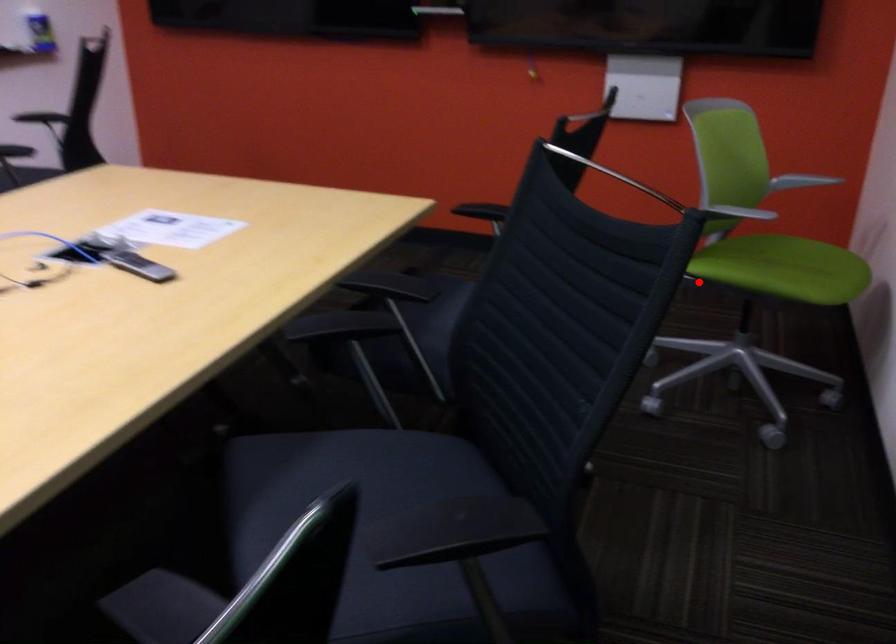
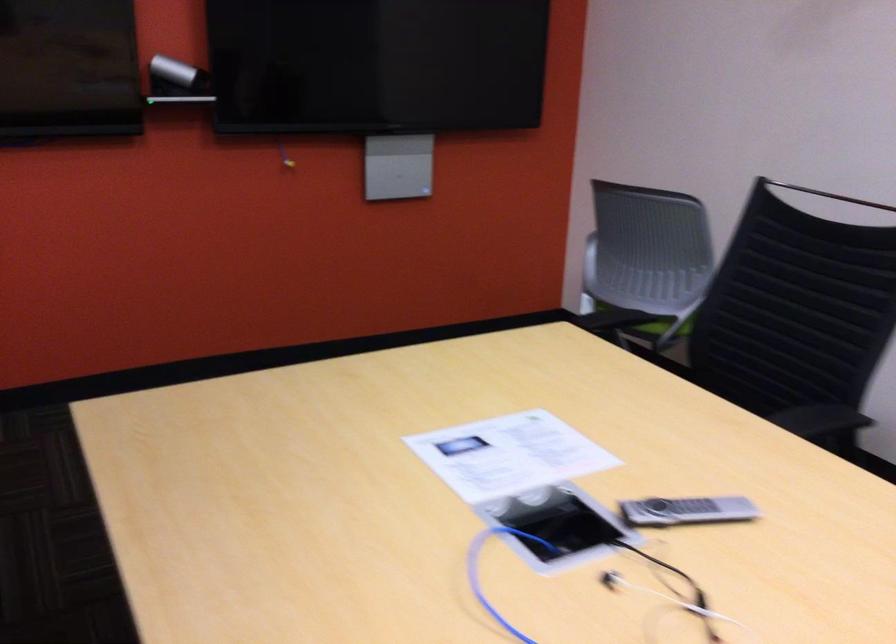
Locate, in the second image, the point that corresponds to the highlighted location in the first image.

(653, 325)